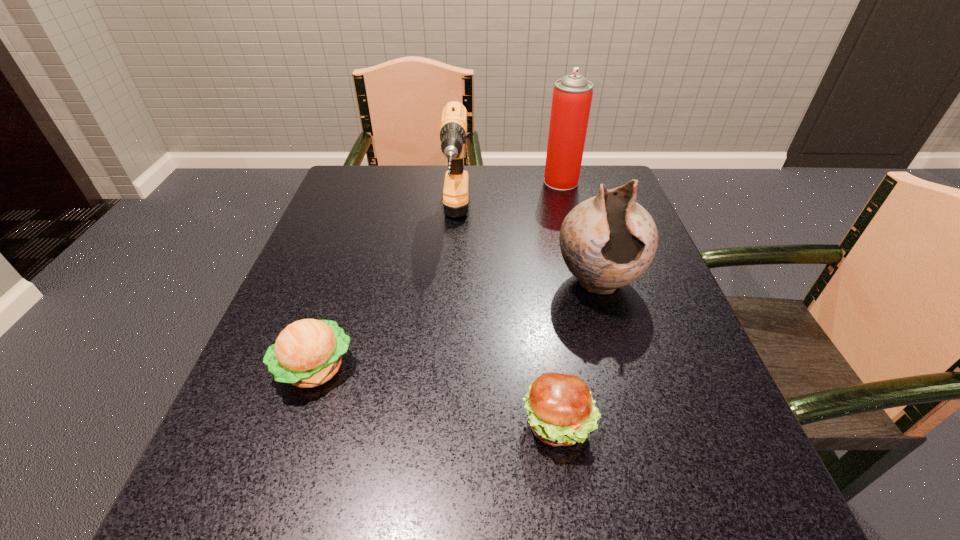
At what (x,y) coordinates should I click in order to perform the action: click on free space between the right hamburger and the pottery. Please return your answer as a coordinate pair (x, y). This screenshot has height=540, width=960. Looking at the image, I should click on (578, 353).

Find the location of a particular element. Image resolution: width=960 pixels, height=540 pixels. unoccupied position between the aerosol can and the leftmost object is located at coordinates (438, 275).

Locate an element on the screen. This screenshot has width=960, height=540. the second closest object to the pottery is located at coordinates (453, 127).

The width and height of the screenshot is (960, 540). In order to click on object that can be found as the closest to the right hamburger in this screenshot , I will do `click(608, 241)`.

Where is `blank area in the image that satisfies the following two spatial constraints: 1. on the front side of the right hamburger; 2. on the left side of the left hamburger`? Image resolution: width=960 pixels, height=540 pixels. blank area in the image that satisfies the following two spatial constraints: 1. on the front side of the right hamburger; 2. on the left side of the left hamburger is located at coordinates (296, 424).